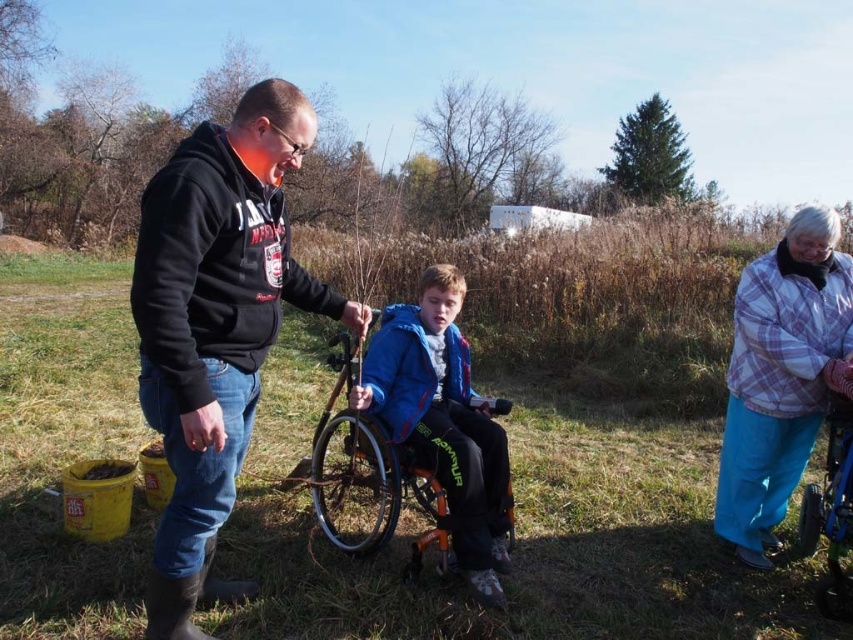
Who is more forward, (410, 416) or (840, 524)?

Point (840, 524)

Can you confirm if orange metallic wheelchair at center is positioned to the right of blue plastic wheelchair at lower right?

No, orange metallic wheelchair at center is not to the right of blue plastic wheelchair at lower right.

Does point (390, 484) come closer to viewer compared to point (848, 476)?

That is False.

Where is `orange metallic wheelchair at center`? The width and height of the screenshot is (853, 640). orange metallic wheelchair at center is located at coordinates (373, 468).

Measure the distance between plaid fabric jacket at lower right and camera.

A distance of 9.90 feet exists between plaid fabric jacket at lower right and camera.

Does plaid fabric jacket at lower right lie in front of orange metallic wheelchair at center?

No, it is behind orange metallic wheelchair at center.

Does point (759, 429) lie in front of point (418, 538)?

No, (759, 429) is behind (418, 538).

Find the location of a particular element. plaid fabric jacket at lower right is located at coordinates (781, 376).

Between black matte hoodie at center and blue plastic wheelchair at lower right, which one appears on the left side from the viewer's perspective?

From the viewer's perspective, black matte hoodie at center appears more on the left side.

Describe the element at coordinates (215, 324) in the screenshot. I see `black matte hoodie at center` at that location.

Where is `black matte hoodie at center`? The height and width of the screenshot is (640, 853). black matte hoodie at center is located at coordinates (215, 324).